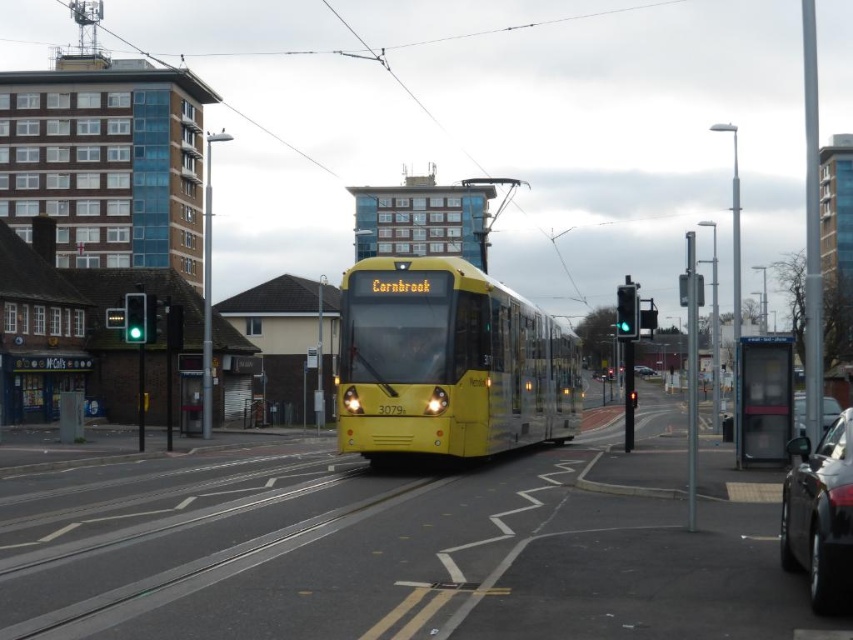
Question: Does shiny black car at lower right lie in front of metallic silver car at center?

Choices:
 (A) no
 (B) yes

Answer: (B)

Question: Does shiny black car at lower right have a greater width compared to metallic silver car at center?

Choices:
 (A) no
 (B) yes

Answer: (A)

Question: Among these objects, which one is farthest from the camera?

Choices:
 (A) metallic silver car at center
 (B) shiny black car at lower right

Answer: (A)

Question: Where is shiny black car at lower right located in relation to metallic silver car at center in the image?

Choices:
 (A) below
 (B) above

Answer: (B)